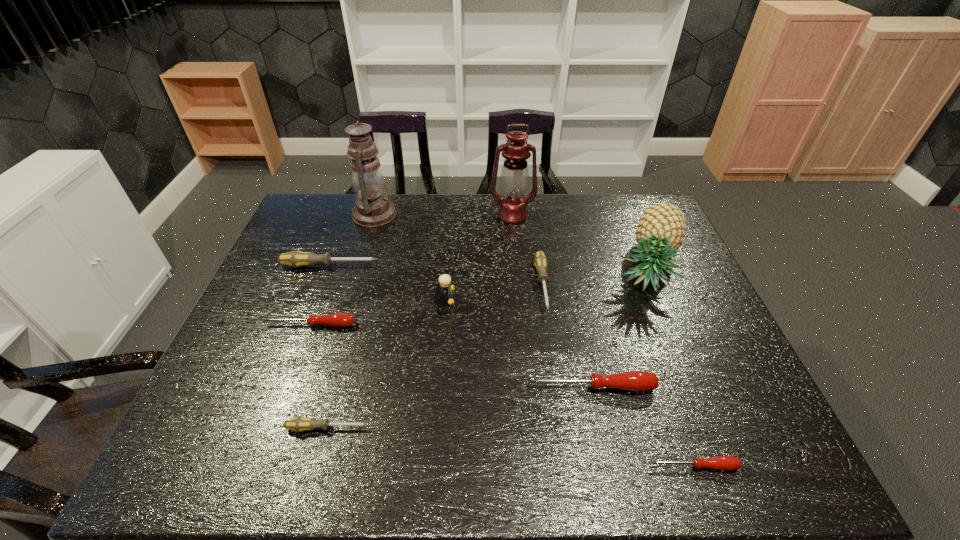
This screenshot has height=540, width=960. I want to click on vacant area that satisfies the following two spatial constraints: 1. on the front-facing side of the Lego; 2. on the back side of the nearest red screwdriver, so click(431, 466).